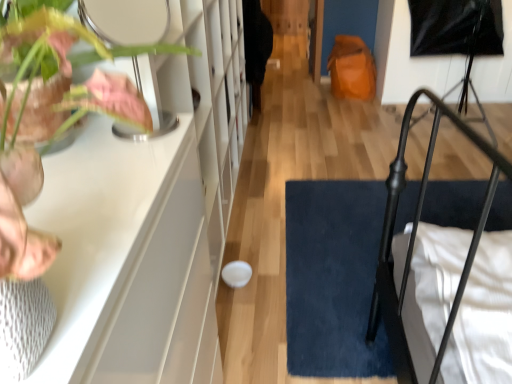
Question: Is point (x=39, y=185) closer or farther from the camera than point (x=323, y=359)?

Choices:
 (A) closer
 (B) farther

Answer: (A)

Question: In terms of width, does matte pink leaf at left look wider or thinner when compared to dark blue plush doormat at lower right?

Choices:
 (A) thin
 (B) wide

Answer: (A)

Question: Is matte pink leaf at left spatially inside dark blue plush doormat at lower right, or outside of it?

Choices:
 (A) inside
 (B) outside

Answer: (B)

Question: From the image's perspective, is dark blue plush doormat at lower right positioned above or below matte pink leaf at left?

Choices:
 (A) above
 (B) below

Answer: (B)

Question: Is dark blue plush doormat at lower right to the left or to the right of matte pink leaf at left in the image?

Choices:
 (A) left
 (B) right

Answer: (B)

Question: Is point (335, 349) positioned closer to the camera than point (16, 274)?

Choices:
 (A) farther
 (B) closer

Answer: (A)

Question: From a real-world perspective, is dark blue plush doormat at lower right positioned above or below matte pink leaf at left?

Choices:
 (A) below
 (B) above

Answer: (A)